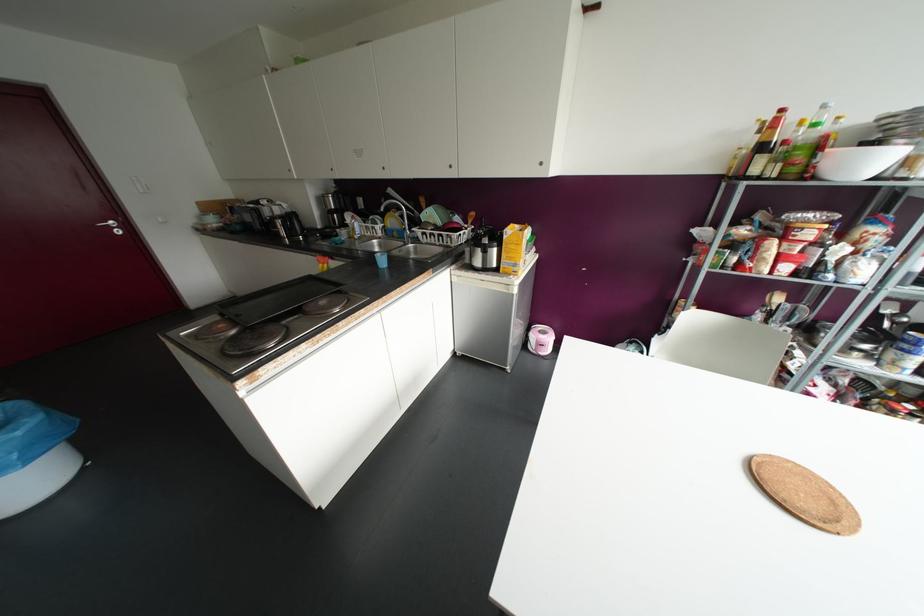
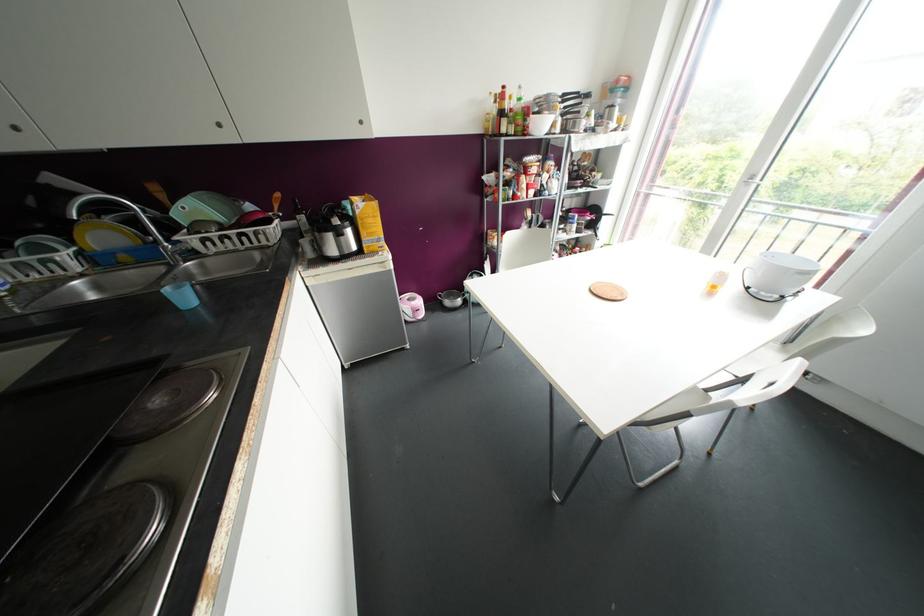
Find the pixel in the second image that matches the point at 541,163 in the first image.

(360, 122)